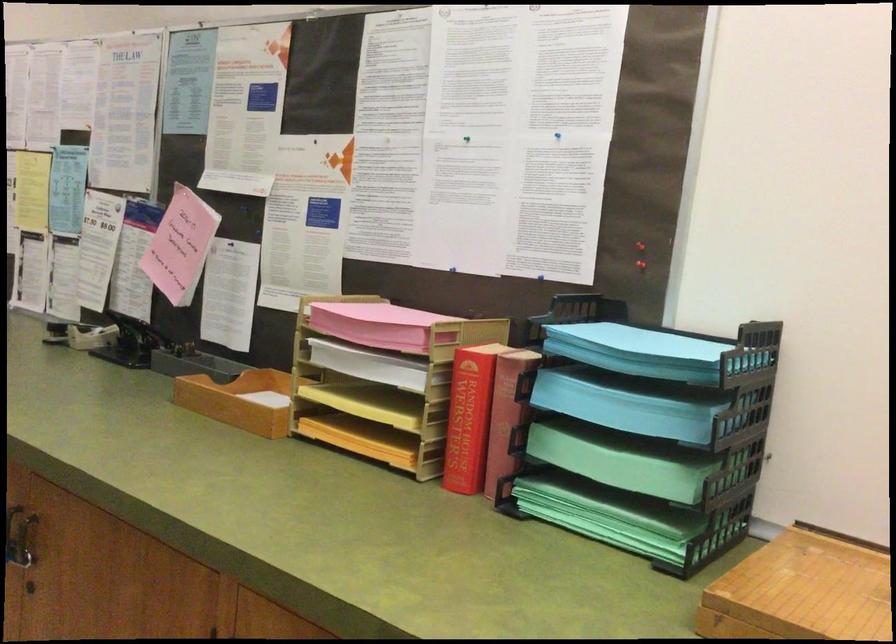
I want to click on red thumbtack, so click(640, 245).